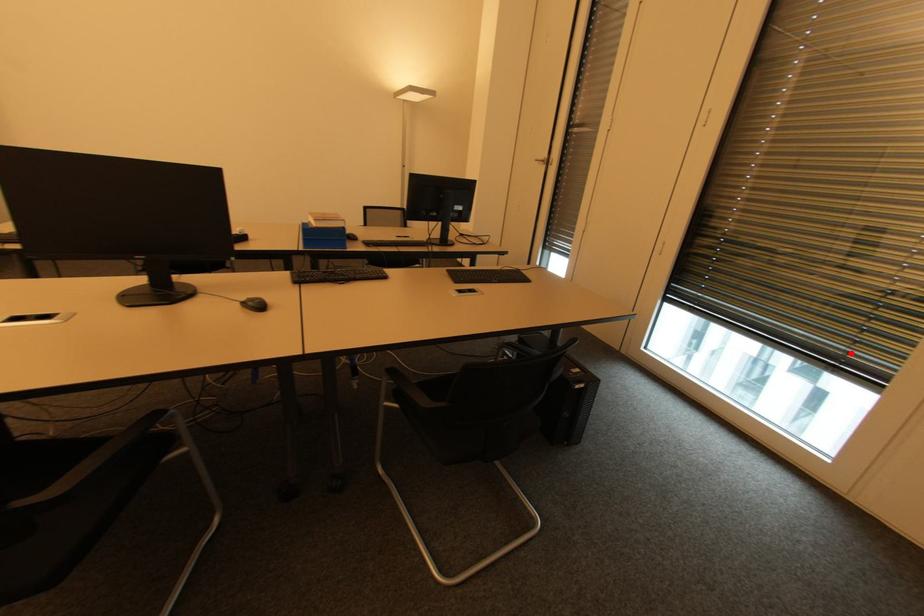
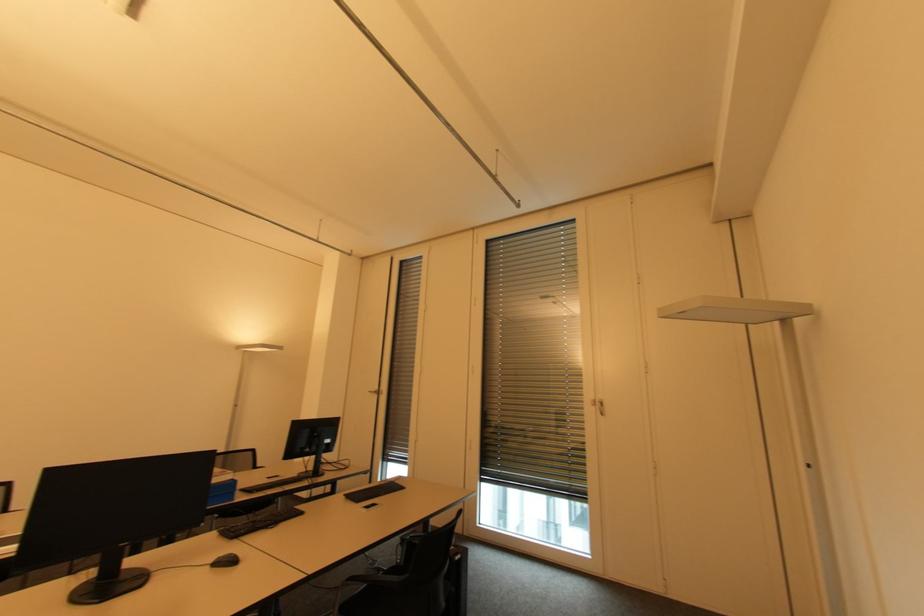
Question: I am providing you with two images of the same scene from different viewpoints. In image1, a red point is highlighted. Considering the same 3D point in image2, which of the following is correct?

Choices:
 (A) It is closer
 (B) It is farther

Answer: (A)